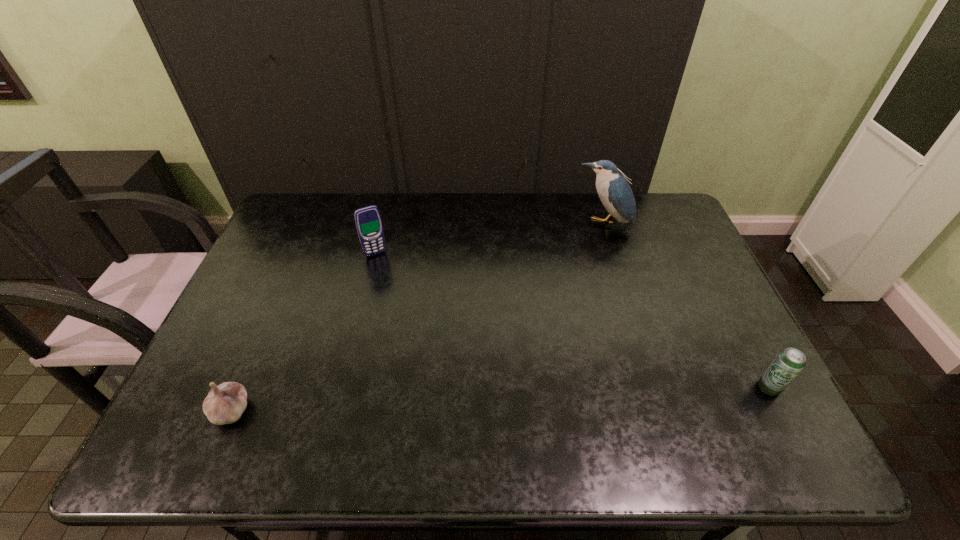
This screenshot has height=540, width=960. Identify the location of free space on the desktop that is between the garlic and the beer can and is positioned on the front-facing side of the second farthest object. (449, 401).

This screenshot has width=960, height=540. What are the coordinates of `vacant spot on the desktop that is between the garlic and the rightmost object and is positioned at the tip of the farthest object's beak` in the screenshot? It's located at (547, 396).